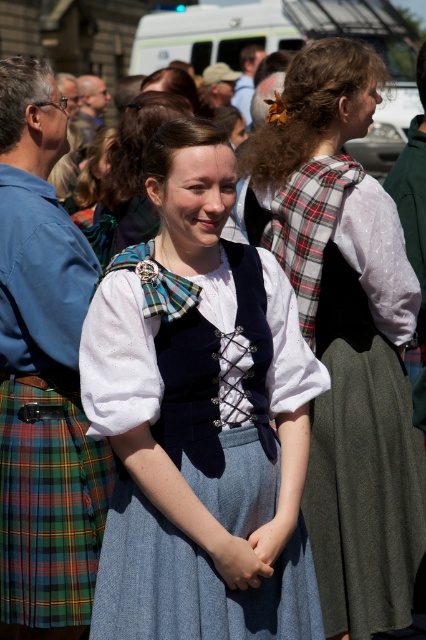
Does denim skirt at center have a lesser height compared to matte blue dress at center?

In fact, denim skirt at center may be taller than matte blue dress at center.

Does denim skirt at center have a lesser width compared to matte blue dress at center?

In fact, denim skirt at center might be wider than matte blue dress at center.

Is point (173, 586) in front of point (143, 204)?

Yes.

Find the location of a particular element. The width and height of the screenshot is (426, 640). denim skirt at center is located at coordinates (203, 376).

Who is shorter, denim skirt at center or plaid fabric dress at center?

denim skirt at center

The image size is (426, 640). Find the location of `denim skirt at center`. denim skirt at center is located at coordinates (203, 376).

This screenshot has width=426, height=640. Find the location of `denim skirt at center`. denim skirt at center is located at coordinates (203, 376).

Can you confirm if green plaid kilt at lower left is smaller than matte blue dress at center?

Yes.

This screenshot has height=640, width=426. What do you see at coordinates (48, 506) in the screenshot?
I see `green plaid kilt at lower left` at bounding box center [48, 506].

Where is `green plaid kilt at lower left`? The image size is (426, 640). green plaid kilt at lower left is located at coordinates (48, 506).